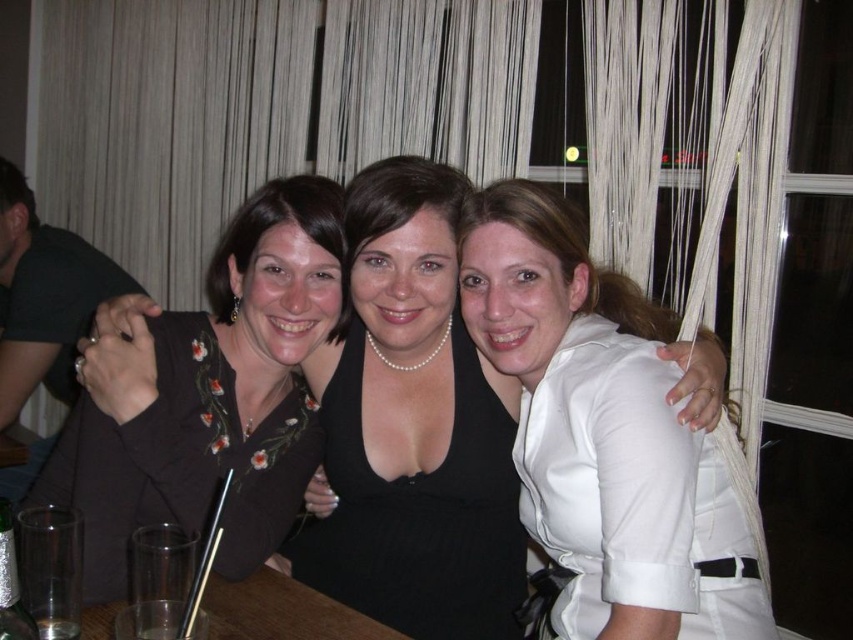
You are a photographer trying to capture the white satin blouse at upper right located at point (602, 435). The camera you are using has a focal length of 50mm. To ensure the blouse is in focus, what adjustment should you make to the camera settings?

To ensure the white satin blouse at upper right is in focus, you should adjust the camera settings to focus at the point (602, 435).

You are a photographer at the event and want to capture a photo of the white satin blouse at upper right and the dark brown fabric shirt at left. Which one is more to the right in the image?

The white satin blouse at upper right is more to the right in the image because it is positioned on the right side of the dark brown fabric shirt at left.